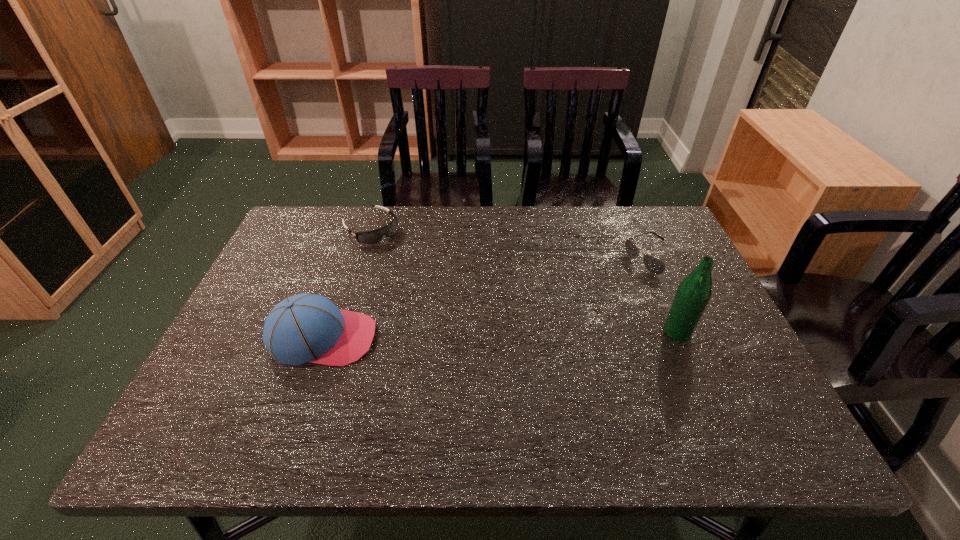
In order to click on vacant region at the left edge of the desktop in this screenshot , I will do `click(261, 365)`.

Where is `vacant space at the right edge of the desktop`? vacant space at the right edge of the desktop is located at coordinates (692, 357).

Image resolution: width=960 pixels, height=540 pixels. Find the location of `vacant space at the far right corner`. vacant space at the far right corner is located at coordinates (655, 235).

Find the location of `empty space between the sunglasses and the third shortest object`. empty space between the sunglasses and the third shortest object is located at coordinates (491, 299).

Where is `vacant space in between the sunglasses and the bottle`? This screenshot has height=540, width=960. vacant space in between the sunglasses and the bottle is located at coordinates (667, 295).

Find the location of a particular element. unoccupied area between the baseball cap and the bottle is located at coordinates (500, 335).

You are a GUI agent. You are given a task and a screenshot of the screen. Output one action in this format:
    pyautogui.click(x=<x>, y=<y>)
    Task: Click on the free space between the sunglasses and the goggles
    Image resolution: width=960 pixels, height=540 pixels.
    Given the screenshot: What is the action you would take?
    pyautogui.click(x=514, y=244)

Find the location of `empty location between the second tallest object and the goggles`. empty location between the second tallest object and the goggles is located at coordinates (347, 284).

At what (x,y) coordinates should I click in order to perform the action: click on free point between the goggles and the baseball cap. Please return your answer as a coordinate pair (x, y). The height and width of the screenshot is (540, 960). Looking at the image, I should click on (347, 284).

Locate an element on the screen. This screenshot has height=540, width=960. free spot between the bottle and the goggles is located at coordinates (524, 280).